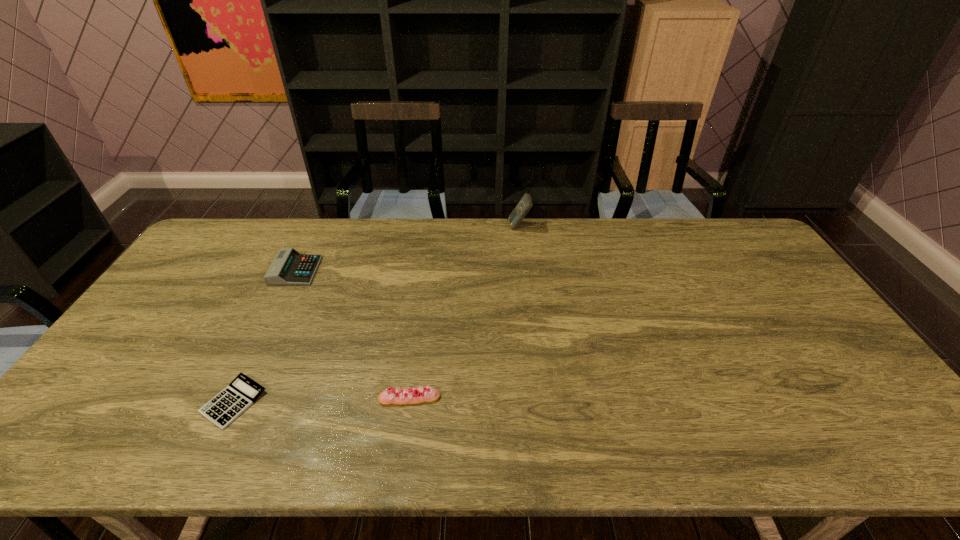
Locate an element on the screen. This screenshot has width=960, height=540. free space located 0.140m on the front of the second farthest calculator is located at coordinates (273, 318).

Image resolution: width=960 pixels, height=540 pixels. Find the location of `vacant area situated on the right of the eclair`. vacant area situated on the right of the eclair is located at coordinates (472, 398).

In order to click on vacant point located on the right of the shortest calculator in this screenshot , I will do `click(316, 402)`.

Locate an element on the screen. Image resolution: width=960 pixels, height=540 pixels. object that is at the near edge is located at coordinates (242, 392).

The height and width of the screenshot is (540, 960). Identify the location of vacant space at the far edge. (565, 245).

The width and height of the screenshot is (960, 540). What are the coordinates of `blank space at the near edge of the desktop` in the screenshot? It's located at (400, 430).

Locate an element on the screen. free location at the left edge of the desktop is located at coordinates (152, 333).

Find the location of a particular element. vacant space at the right edge is located at coordinates (833, 343).

Find the location of a particular element. The image size is (960, 540). vacant space at the far right corner is located at coordinates (748, 241).

Identify the location of free space between the second shortest calculator and the shortest object. Image resolution: width=960 pixels, height=540 pixels. (265, 336).